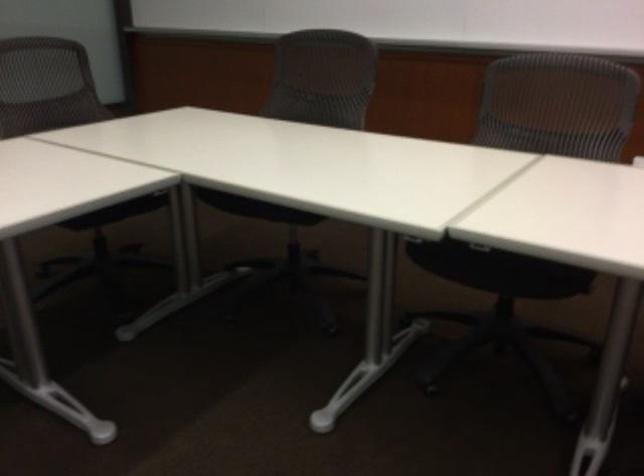
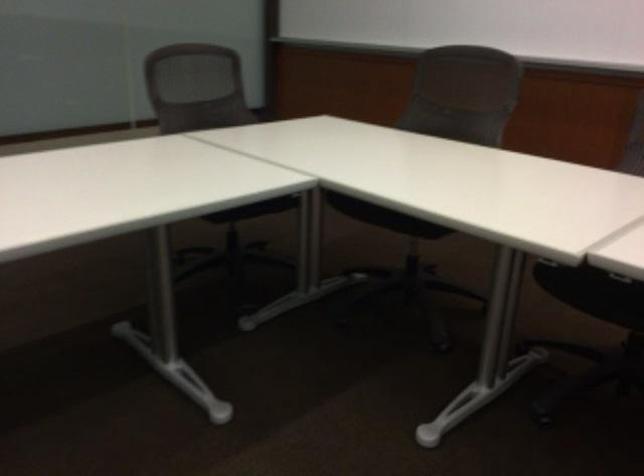
Which direction would the cameraman need to move to produce the second image?

The cameraman moved toward left, backward.